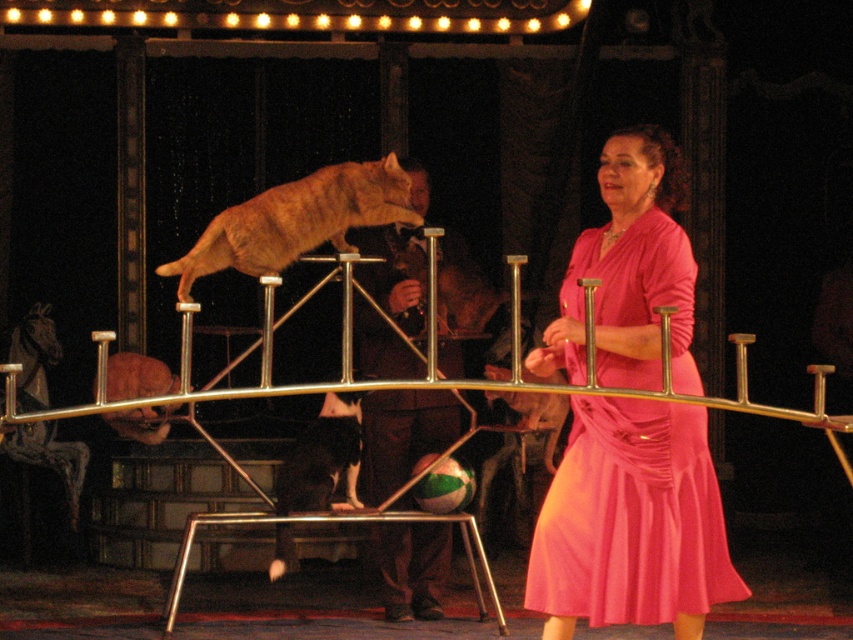
Question: Is pink satin dress at center below smooth leather glove at center?

Choices:
 (A) no
 (B) yes

Answer: (B)

Question: Does smooth leather glove at center have a smaller size compared to orange fur cat at center?

Choices:
 (A) yes
 (B) no

Answer: (B)

Question: Can you confirm if pink satin dress at center is positioned to the left of smooth leather glove at center?

Choices:
 (A) yes
 (B) no

Answer: (B)

Question: Which object appears closest to the camera in this image?

Choices:
 (A) smooth leather glove at center
 (B) orange fur cat at center
 (C) pink satin dress at center

Answer: (C)

Question: Which point is farther from the camera taking this photo?

Choices:
 (A) (677, 227)
 (B) (444, 305)

Answer: (B)

Question: Which object is the closest to the orange fur cat at center?

Choices:
 (A) smooth leather glove at center
 (B) pink satin dress at center

Answer: (A)